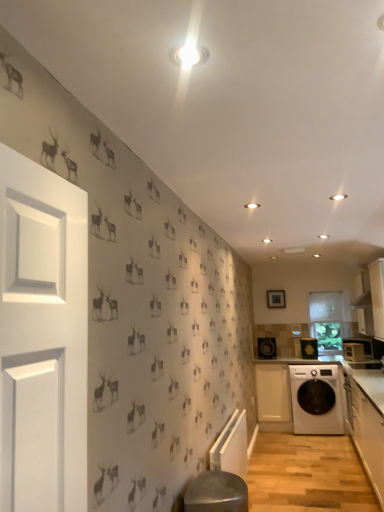
Question: Should I look upward or downward to see white glossy washing machine at lower right?

Choices:
 (A) up
 (B) down

Answer: (B)

Question: From a real-world perspective, is white glossy washing machine at lower right over white glossy microwave at right, placed as the 3th appliance when sorted from left to right?

Choices:
 (A) yes
 (B) no

Answer: (B)

Question: Considering the relative sizes of white glossy washing machine at lower right and white glossy microwave at right, arranged as the 3th appliance when viewed from the back, in the image provided, is white glossy washing machine at lower right thinner than white glossy microwave at right, arranged as the 3th appliance when viewed from the back,?

Choices:
 (A) no
 (B) yes

Answer: (A)

Question: Is white glossy microwave at right, marked as the first appliance in a right-to-left arrangement, a part of white glossy washing machine at lower right?

Choices:
 (A) no
 (B) yes

Answer: (A)

Question: Considering the relative sizes of white glossy washing machine at lower right and white glossy microwave at right, which is the first appliance in front-to-back order, in the image provided, is white glossy washing machine at lower right taller than white glossy microwave at right, which is the first appliance in front-to-back order,?

Choices:
 (A) no
 (B) yes

Answer: (B)

Question: From the image's perspective, does white glossy washing machine at lower right appear higher than white glossy microwave at right, arranged as the 3th appliance when viewed from the back?

Choices:
 (A) no
 (B) yes

Answer: (A)

Question: Could you tell me if white glossy washing machine at lower right is turned towards white glossy microwave at right, marked as the first appliance in a right-to-left arrangement?

Choices:
 (A) no
 (B) yes

Answer: (A)

Question: Is metallic stool at lower center oriented away from white glossy washing machine at lower right?

Choices:
 (A) yes
 (B) no

Answer: (B)

Question: Is metallic stool at lower center smaller than white glossy washing machine at lower right?

Choices:
 (A) no
 (B) yes

Answer: (B)

Question: Does metallic stool at lower center have a larger size compared to white glossy washing machine at lower right?

Choices:
 (A) no
 (B) yes

Answer: (A)

Question: From the image's perspective, is metallic stool at lower center beneath white glossy washing machine at lower right?

Choices:
 (A) no
 (B) yes

Answer: (A)

Question: Considering the relative sizes of metallic stool at lower center and white glossy washing machine at lower right in the image provided, is metallic stool at lower center thinner than white glossy washing machine at lower right?

Choices:
 (A) yes
 (B) no

Answer: (A)

Question: Is metallic stool at lower center positioned behind white glossy washing machine at lower right?

Choices:
 (A) yes
 (B) no

Answer: (B)

Question: Is white matte cabinet at lower right, the third cabinetry when ordered from front to back, placed right next to black plastic speaker at center, the 1th appliance in the left-to-right sequence?

Choices:
 (A) yes
 (B) no

Answer: (B)